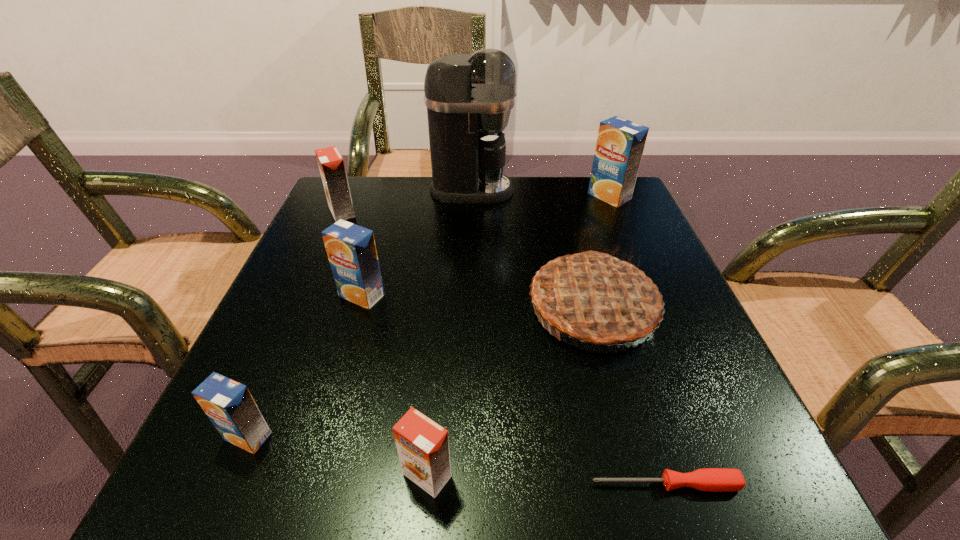
I want to click on object present at the far right corner, so click(x=620, y=144).

Image resolution: width=960 pixels, height=540 pixels. In order to click on object that is at the near right corner in this screenshot , I will do `click(708, 479)`.

Identify the location of vacant region at the far edge of the desktop. (428, 228).

Find the location of a particular element. free region at the left edge of the desktop is located at coordinates (306, 239).

This screenshot has width=960, height=540. Identify the location of vacant area at the right edge of the desktop. (659, 415).

At what (x,y) coordinates should I click in order to perform the action: click on vacant space at the far left corner. Please return your answer as a coordinate pair (x, y). Looking at the image, I should click on (357, 225).

Where is `free space at the near left corner of the desktop`? The image size is (960, 540). free space at the near left corner of the desktop is located at coordinates (266, 483).

Image resolution: width=960 pixels, height=540 pixels. Identify the location of free space that is in between the bigger orange orange juice and the nearest blue orange_juice. (295, 324).

You are a GUI agent. You are given a task and a screenshot of the screen. Output one action in this format:
    pyautogui.click(x=<x>, y=<y>)
    Task: Click on the blank region between the pie and the nearest blue orange_juice
    
    Given the screenshot: What is the action you would take?
    pyautogui.click(x=420, y=372)

Find the location of `free space between the pie and the left orange orange juice`. free space between the pie and the left orange orange juice is located at coordinates (468, 259).